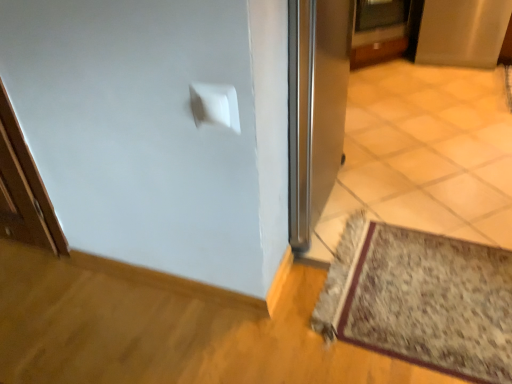
Question: Is floral carpet at lower right positioned in front of metallic silver door at upper center?

Choices:
 (A) no
 (B) yes

Answer: (B)

Question: Is metallic silver door at upper center inside floral carpet at lower right?

Choices:
 (A) yes
 (B) no

Answer: (B)

Question: Considering the relative positions of floral carpet at lower right and metallic silver door at upper center in the image provided, is floral carpet at lower right to the right of metallic silver door at upper center from the viewer's perspective?

Choices:
 (A) no
 (B) yes

Answer: (A)

Question: Can you confirm if floral carpet at lower right is bigger than metallic silver door at upper center?

Choices:
 (A) no
 (B) yes

Answer: (A)

Question: Is floral carpet at lower right positioned behind metallic silver door at upper center?

Choices:
 (A) yes
 (B) no

Answer: (B)

Question: From the image's perspective, relative to floral carpet at lower right, is satin silver screen door at upper right above or below?

Choices:
 (A) below
 (B) above

Answer: (B)

Question: Based on their positions, is satin silver screen door at upper right located to the left or right of floral carpet at lower right?

Choices:
 (A) left
 (B) right

Answer: (B)

Question: Is satin silver screen door at upper right bigger or smaller than floral carpet at lower right?

Choices:
 (A) small
 (B) big

Answer: (B)

Question: Is satin silver screen door at upper right inside the boundaries of floral carpet at lower right, or outside?

Choices:
 (A) outside
 (B) inside

Answer: (A)

Question: From the image's perspective, is floral carpet at lower right located above or below satin silver screen door at upper right?

Choices:
 (A) above
 (B) below

Answer: (B)

Question: Considering the positions of floral carpet at lower right and satin silver screen door at upper right in the image, is floral carpet at lower right wider or thinner than satin silver screen door at upper right?

Choices:
 (A) thin
 (B) wide

Answer: (A)

Question: From a real-world perspective, is floral carpet at lower right physically located above or below satin silver screen door at upper right?

Choices:
 (A) above
 (B) below

Answer: (B)

Question: Is floral carpet at lower right inside or outside of satin silver screen door at upper right?

Choices:
 (A) outside
 (B) inside

Answer: (A)

Question: Visually, is satin silver screen door at upper right positioned to the left or to the right of metallic silver door at upper center?

Choices:
 (A) left
 (B) right

Answer: (B)

Question: From the image's perspective, is satin silver screen door at upper right located above or below metallic silver door at upper center?

Choices:
 (A) above
 (B) below

Answer: (B)